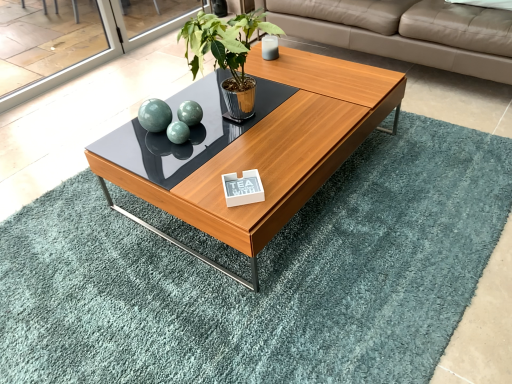
At what (x,y) coordinates should I click in order to perform the action: click on free location in front of white glossy plaque at center. Please return your answer as a coordinate pair (x, y). Image resolution: width=512 pixels, height=384 pixels. Looking at the image, I should click on (241, 216).